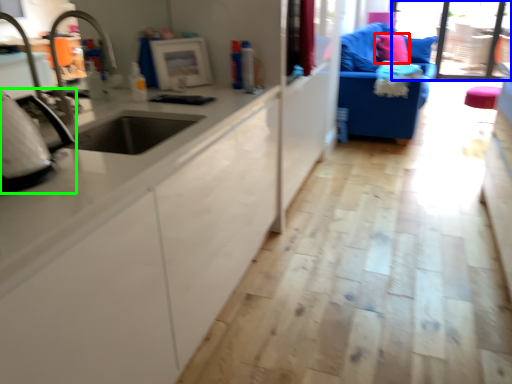
Question: Based on their relative distances, which object is nearer to pillow (highlighted by a red box)? Choose from window screen (highlighted by a blue box) and appliance (highlighted by a green box).

Choices:
 (A) window screen
 (B) appliance

Answer: (A)